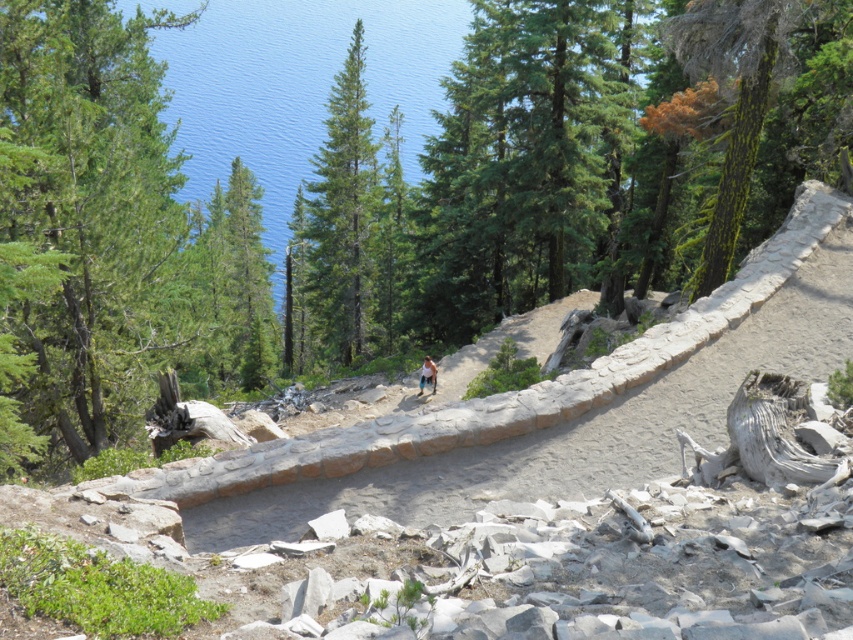
Question: Is green matte tree at center below light blue denim shorts at center?

Choices:
 (A) yes
 (B) no

Answer: (B)

Question: Does green textured tree at upper left have a larger size compared to green matte tree at center?

Choices:
 (A) no
 (B) yes

Answer: (A)

Question: Among these points, which one is nearest to the camera?

Choices:
 (A) (427, 369)
 (B) (346, 109)

Answer: (A)

Question: Which object is farther from the camera taking this photo?

Choices:
 (A) green matte tree at center
 (B) green textured tree at upper left
 (C) light blue denim shorts at center

Answer: (A)

Question: Does green textured tree at upper left have a smaller size compared to green matte tree at center?

Choices:
 (A) yes
 (B) no

Answer: (A)

Question: Among these points, which one is farthest from the camera?

Choices:
 (A) (424, 380)
 (B) (297, 253)
 (C) (47, 140)

Answer: (B)